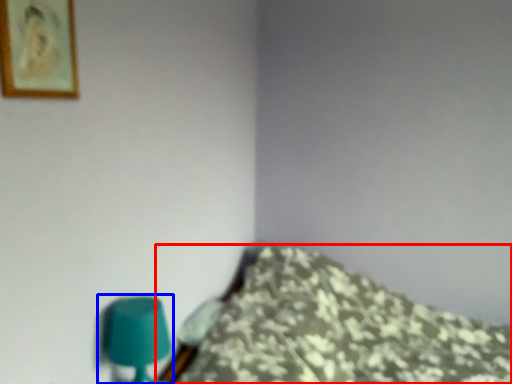
Question: Which object is closer to the camera taking this photo, furniture (highlighted by a red box) or table lamp (highlighted by a blue box)?

Choices:
 (A) furniture
 (B) table lamp

Answer: (A)